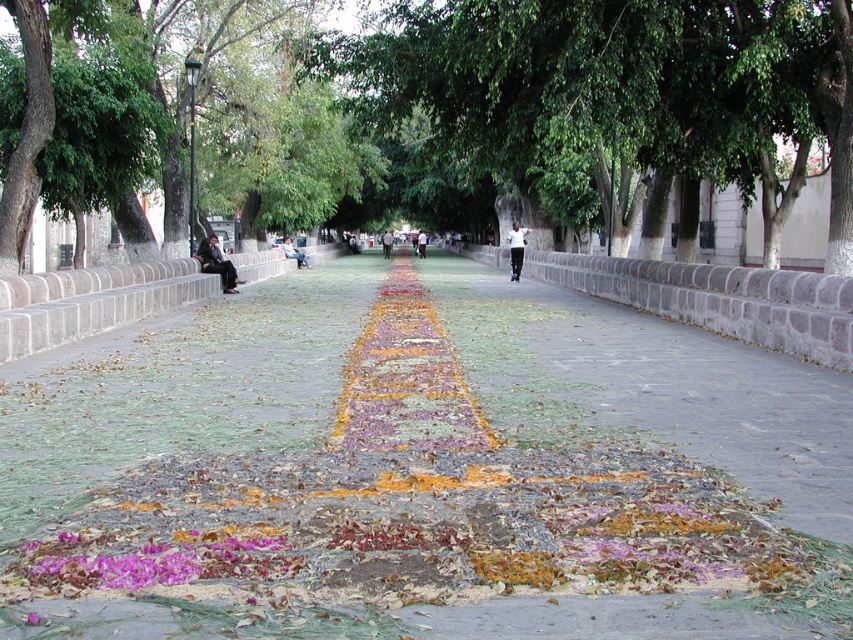
Is point (16, 291) closer to camera compared to point (42, 550)?

No.

Is point (257, 269) behind point (160, 556)?

Yes, it is behind point (160, 556).

The image size is (853, 640). In order to click on gray concrete bench at center in this screenshot , I will do `click(91, 301)`.

Who is shorter, multicolored floral carpet at center or purple floral carpet at center?

With less height is purple floral carpet at center.

I want to click on multicolored floral carpet at center, so click(x=419, y=474).

Does green leafy tree at center appear on the right side of gray stone curb at center?

No, green leafy tree at center is not to the right of gray stone curb at center.

Is point (834, 234) farther from viewer compared to point (746, 323)?

Yes.

Where is `green leafy tree at center`? Image resolution: width=853 pixels, height=640 pixels. green leafy tree at center is located at coordinates (451, 109).